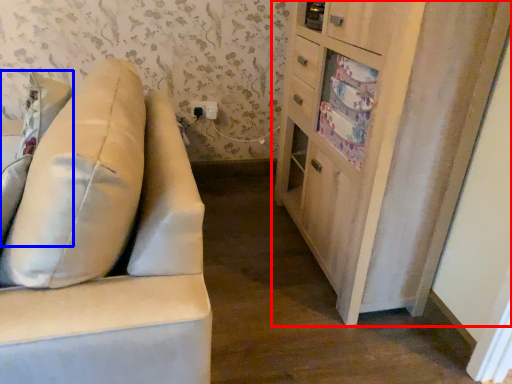
Question: Which object appears closest to the camera in this image, cabinetry (highlighted by a red box) or pillow (highlighted by a blue box)?

Choices:
 (A) cabinetry
 (B) pillow

Answer: (B)